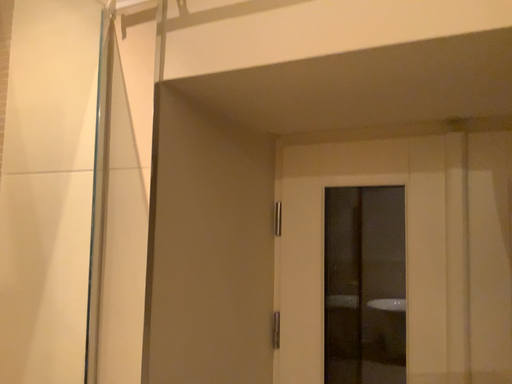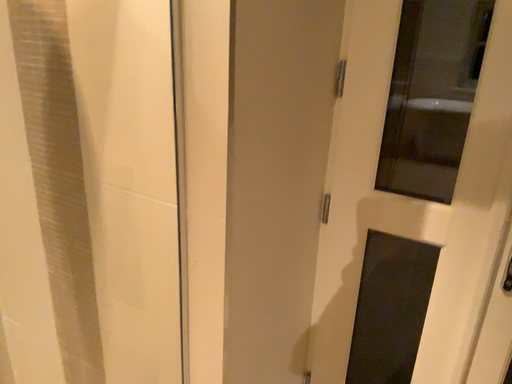
Question: How did the camera likely rotate when shooting the video?

Choices:
 (A) rotated upward
 (B) rotated downward

Answer: (B)